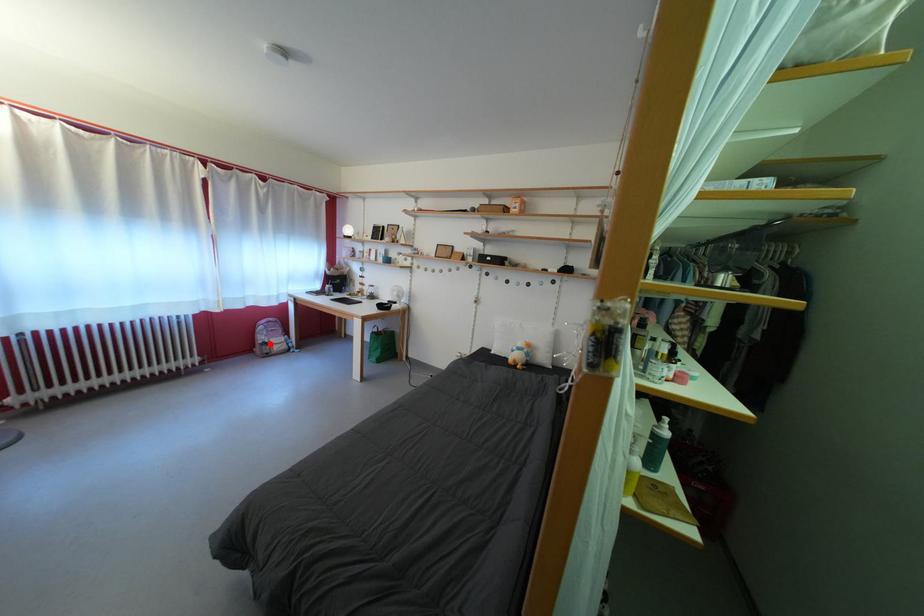
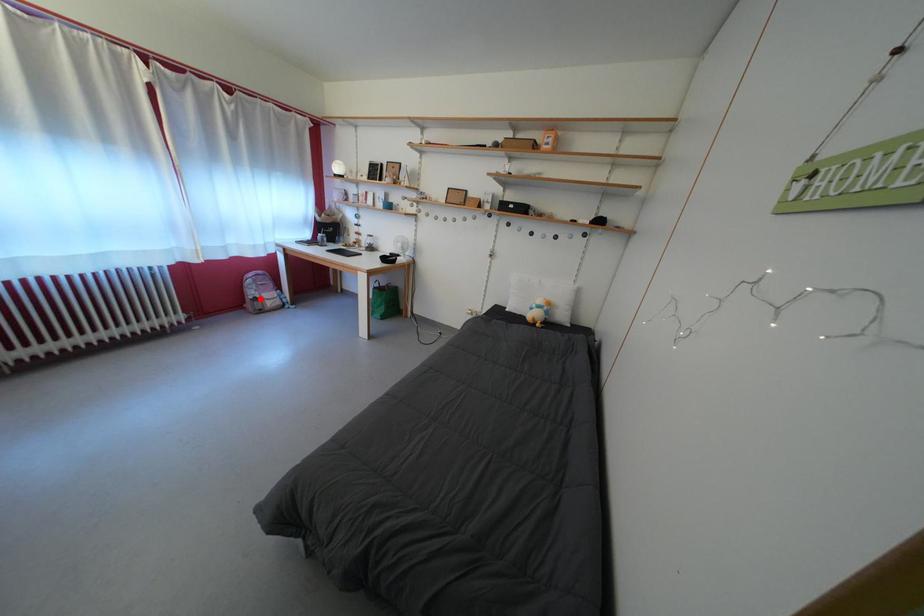
I am providing you with two images of the same scene from different viewpoints. A red point is marked on the first image and another point is marked on the second image. Is the red point in image1 aligned with the point shown in image2?

Yes